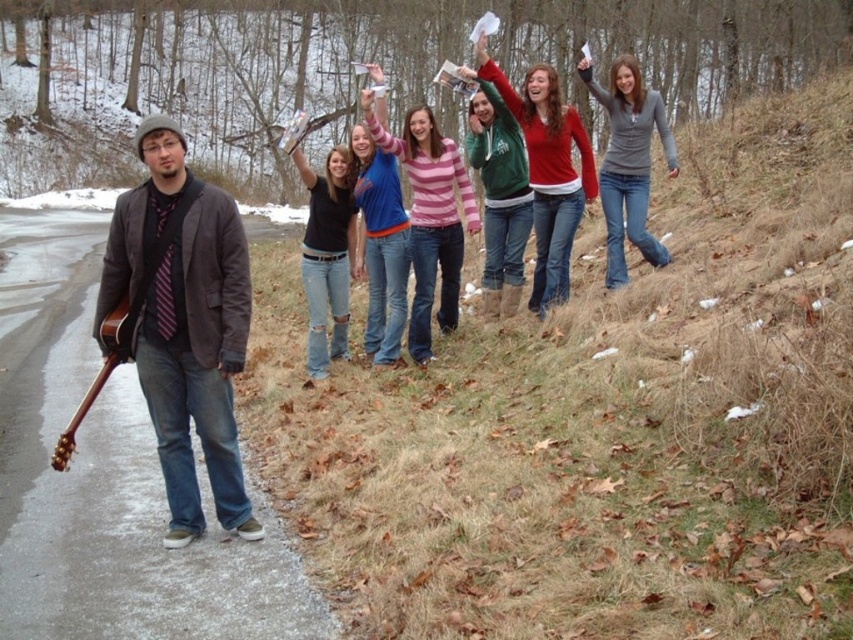
Question: Can you confirm if matte black jacket at left is thinner than black matte shirt at center?

Choices:
 (A) no
 (B) yes

Answer: (A)

Question: In this image, where is pink striped sweater at center located relative to green fuzzy sweater at center?

Choices:
 (A) right
 (B) left

Answer: (B)

Question: Which object appears closest to the camera in this image?

Choices:
 (A) red sweater at center
 (B) gray matte shirt at upper right

Answer: (A)

Question: Which object appears farthest from the camera in this image?

Choices:
 (A) red sweater at center
 (B) matte blue jeans at center
 (C) green fuzzy sweater at center

Answer: (C)

Question: Which of these objects is positioned farthest from the green fuzzy sweater at center?

Choices:
 (A) red sweater at center
 (B) matte black jacket at left
 (C) black matte shirt at center

Answer: (B)

Question: Can you confirm if pink striped sweater at center is positioned below green fuzzy sweater at center?

Choices:
 (A) yes
 (B) no

Answer: (A)